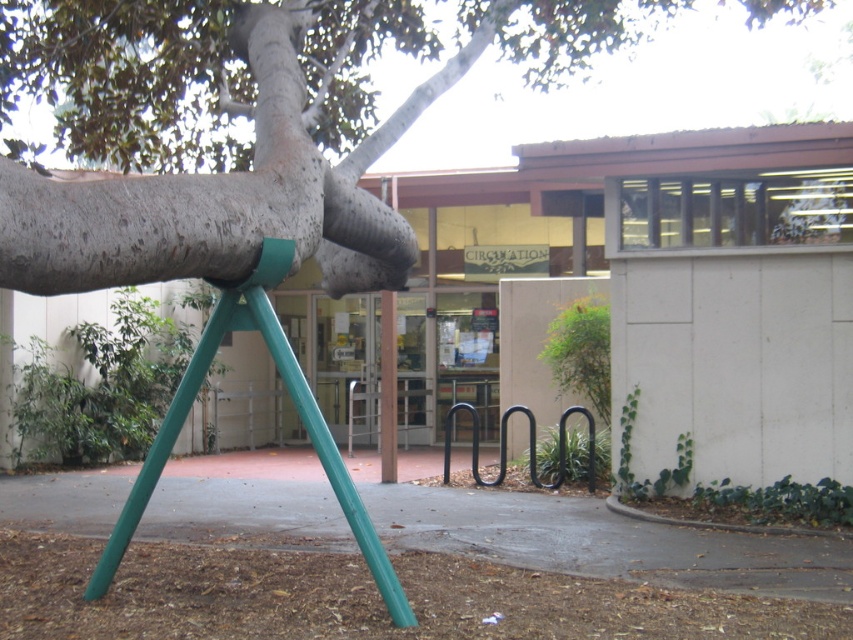
Question: Can you confirm if smooth gray bark at upper center is bigger than green metallic tripod at center?

Choices:
 (A) no
 (B) yes

Answer: (B)

Question: Which of the following is the farthest from the observer?

Choices:
 (A) (331, 88)
 (B) (288, 259)

Answer: (A)

Question: Is smooth gray bark at upper center above green metallic tripod at center?

Choices:
 (A) no
 (B) yes

Answer: (B)

Question: Is smooth gray bark at upper center above green metallic tripod at center?

Choices:
 (A) no
 (B) yes

Answer: (B)